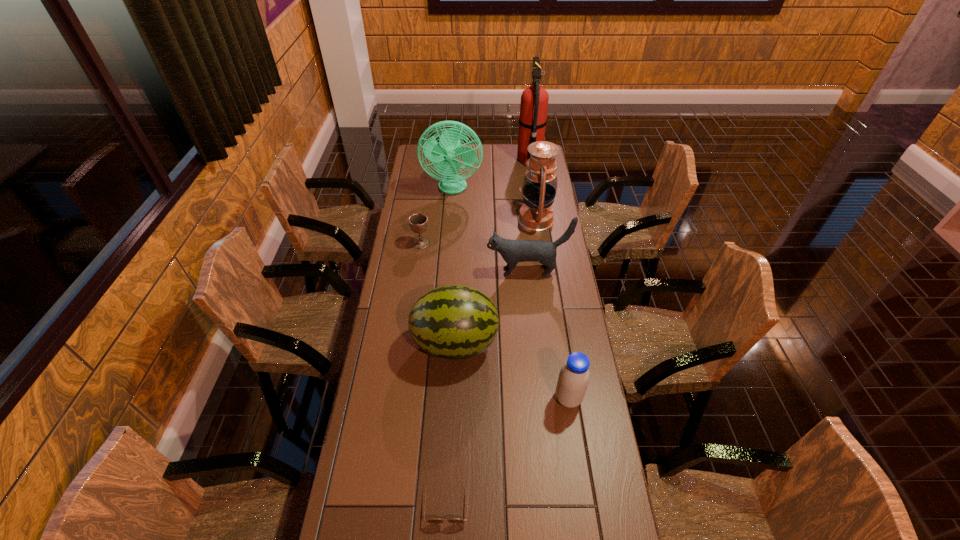
At what (x,y) coordinates should I click in order to perform the action: click on object located at the far right corner. Please return your answer as a coordinate pair (x, y). This screenshot has height=540, width=960. Looking at the image, I should click on (534, 100).

Where is `vacant space at the far edge`? vacant space at the far edge is located at coordinates (487, 151).

You are a GUI agent. You are given a task and a screenshot of the screen. Output one action in this format:
    pyautogui.click(x=<x>, y=<y>)
    Task: Click on the vacant region at the left edge of the desktop
    Image resolution: width=960 pixels, height=540 pixels.
    Given the screenshot: What is the action you would take?
    [361, 524]

You are a GUI agent. You are given a task and a screenshot of the screen. Output one action in this format:
    pyautogui.click(x=<x>, y=<y>)
    Task: Click on the free space at the right edge
    This screenshot has height=540, width=960.
    Given the screenshot: What is the action you would take?
    pyautogui.click(x=568, y=292)

Where is `free space at the far left corner of the desktop`? This screenshot has height=540, width=960. free space at the far left corner of the desktop is located at coordinates (415, 152).

I want to click on vacant point located between the fire extinguisher and the second shortest object, so click(x=475, y=201).

You are a GUI agent. You are given a task and a screenshot of the screen. Output one action in this format:
    pyautogui.click(x=<x>, y=<y>)
    Task: Click on the free spot between the cat and the seventh farthest object
    This screenshot has height=540, width=960.
    Given the screenshot: What is the action you would take?
    pyautogui.click(x=548, y=335)

At what (x,y) coordinates should I click in order to perform the action: click on free space between the sunglasses and the fourth farthest object. Please return your answer as a coordinate pair (x, y). The image size is (960, 540). Looking at the image, I should click on (434, 372).

You are a GUI agent. You are given a task and a screenshot of the screen. Output one action in this format:
    pyautogui.click(x=<x>, y=<y>)
    Task: Click on the free space between the seventh nearest object and the second shortest object
    This screenshot has width=960, height=540.
    Given the screenshot: What is the action you would take?
    pyautogui.click(x=437, y=216)

This screenshot has height=540, width=960. I want to click on free space between the soya milk and the tallest object, so click(549, 279).